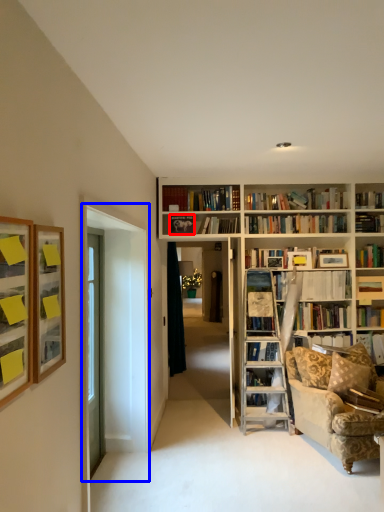
Question: Which object appears closest to the camera in this image, picture frame (highlighted by a red box) or glass door (highlighted by a blue box)?

Choices:
 (A) picture frame
 (B) glass door

Answer: (B)